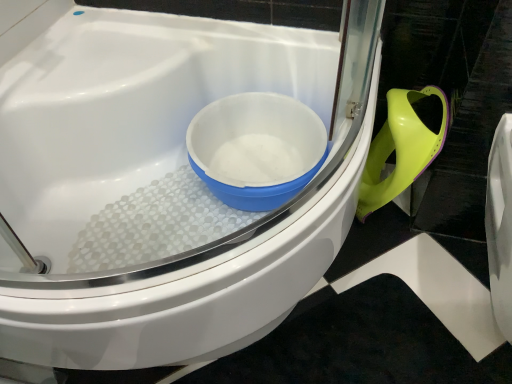
This screenshot has height=384, width=512. Describe the element at coordinates (256, 149) in the screenshot. I see `white plastic bowl at center` at that location.

This screenshot has height=384, width=512. I want to click on white plastic bowl at center, so click(256, 149).

Describe the element at coordinates (164, 185) in the screenshot. I see `white glossy toilet at center` at that location.

Where is `white glossy toilet at center`? The image size is (512, 384). white glossy toilet at center is located at coordinates (164, 185).

Where is `white plastic bowl at center`? The image size is (512, 384). white plastic bowl at center is located at coordinates (256, 149).

Considering the relative positions of white plastic bowl at center and white glossy toilet at center in the image provided, is white plastic bowl at center to the left of white glossy toilet at center from the viewer's perspective?

No.

Considering their positions, is white plastic bowl at center located in front of or behind white glossy toilet at center?

Clearly, white plastic bowl at center is behind white glossy toilet at center.

Between point (269, 159) and point (118, 76), which one is positioned in front?

The point (118, 76) is in front.

From the image's perspective, is white plastic bowl at center below white glossy toilet at center?

No, from the image's perspective, white plastic bowl at center is not beneath white glossy toilet at center.

From a real-world perspective, is white plastic bowl at center physically below white glossy toilet at center?

No, from a real-world perspective, white plastic bowl at center is not beneath white glossy toilet at center.

Which of these two, white plastic bowl at center or white glossy toilet at center, is wider?

With larger width is white glossy toilet at center.

Looking at this image, between white plastic bowl at center and white glossy toilet at center, which one has less height?

white plastic bowl at center is shorter.

Can you confirm if white plastic bowl at center is smaller than white glossy toilet at center?

Correct, white plastic bowl at center occupies less space than white glossy toilet at center.

Which is correct: white plastic bowl at center is inside white glossy toilet at center, or outside of it?

white plastic bowl at center is contained in white glossy toilet at center.

Is white plastic bowl at center directly adjacent to white glossy toilet at center?

No, white plastic bowl at center is not beside white glossy toilet at center.

Is white plastic bowl at center facing away from white glossy toilet at center?

Yes, white glossy toilet at center is at the back of white plastic bowl at center.

What's the angular difference between white plastic bowl at center and white glossy toilet at center's facing directions?

The angular difference between white plastic bowl at center and white glossy toilet at center is 0.459 degrees.

How much distance is there between white plastic bowl at center and white glossy toilet at center?

They are 17.59 centimeters apart.

In order to click on mixing bowl behind the white glossy toilet at center in this screenshot , I will do `click(256, 149)`.

Which is more to the left, white glossy toilet at center or white plastic bowl at center?

From the viewer's perspective, white glossy toilet at center appears more on the left side.

Is white glossy toilet at center in front of or behind white plastic bowl at center in the image?

In the image, white glossy toilet at center appears in front of white plastic bowl at center.

Does point (246, 240) lie in front of point (258, 125)?

That is True.

From the image's perspective, is white glossy toilet at center located beneath white plastic bowl at center?

Yes, from the image's perspective, white glossy toilet at center is below white plastic bowl at center.

From a real-world perspective, who is located higher, white glossy toilet at center or white plastic bowl at center?

white plastic bowl at center, from a real-world perspective.

Between white glossy toilet at center and white plastic bowl at center, which one has larger width?

white glossy toilet at center is wider.

Considering the relative sizes of white glossy toilet at center and white plastic bowl at center in the image provided, is white glossy toilet at center taller than white plastic bowl at center?

Yes, white glossy toilet at center is taller than white plastic bowl at center.

Can you confirm if white glossy toilet at center is smaller than white plastic bowl at center?

No, white glossy toilet at center is not smaller than white plastic bowl at center.

Could white plastic bowl at center be considered to be inside white glossy toilet at center?

Yes, white glossy toilet at center is surrounding white plastic bowl at center.

Would you consider white glossy toilet at center to be distant from white plastic bowl at center?

No, white glossy toilet at center is not far from white plastic bowl at center.

Is white glossy toilet at center turned away from white plastic bowl at center?

Yes, white glossy toilet at center is positioned with its back facing white plastic bowl at center.

Measure the distance between white glossy toilet at center and white plastic bowl at center.

6.93 inches.

What are the coordinates of `toilet in front of the white plastic bowl at center` in the screenshot? It's located at (164, 185).

This screenshot has width=512, height=384. I want to click on toilet directly beneath the white plastic bowl at center (from a real-world perspective), so click(164, 185).

Where is `mixing bowl above the white glossy toilet at center (from the image's perspective)`? The width and height of the screenshot is (512, 384). mixing bowl above the white glossy toilet at center (from the image's perspective) is located at coordinates [256, 149].